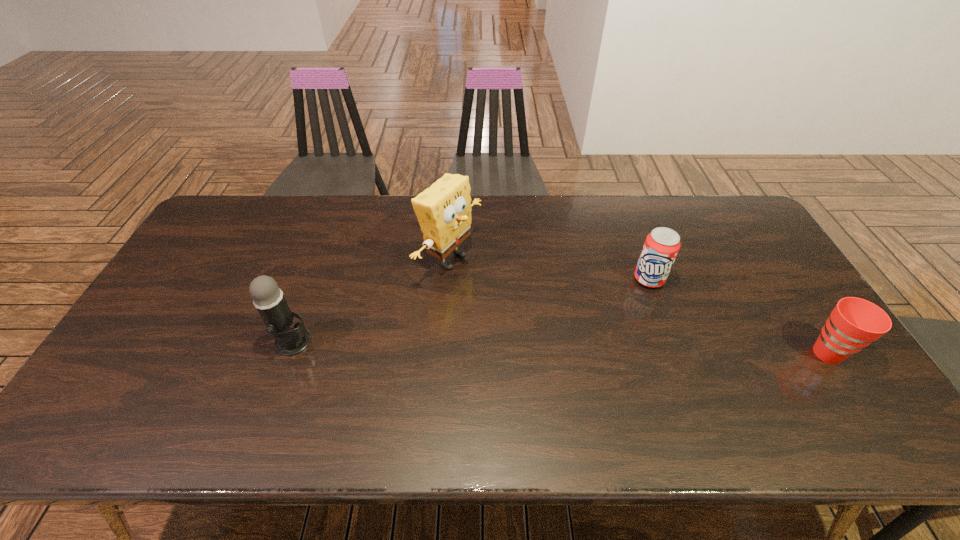
Identify the location of free space on the desktop that is between the leftmost object and the cup and is positioned on the face of the third object from right to left. (636, 349).

Locate an element on the screen. vacant space on the desktop that is between the microphone and the rightmost object and is positioned on the surface of the soda can is located at coordinates (605, 348).